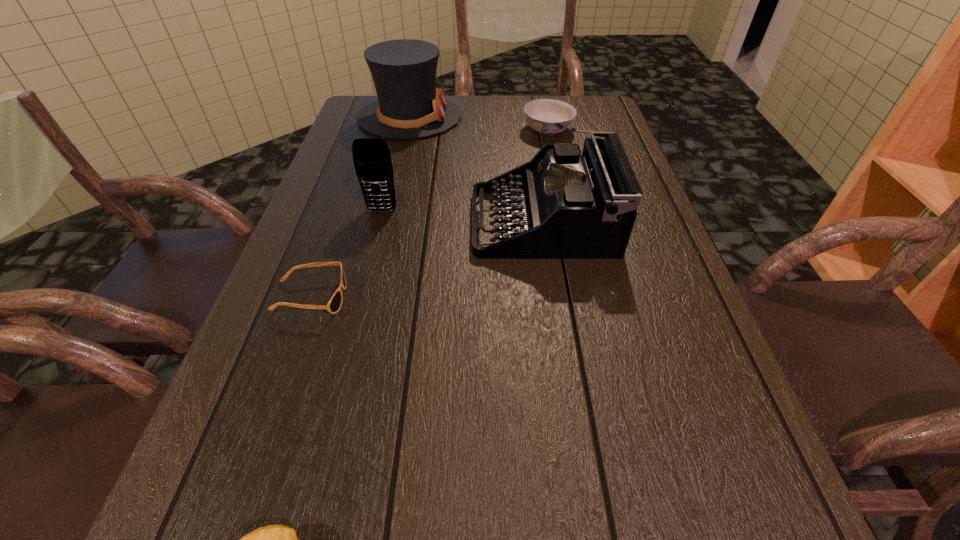
You are a GUI agent. You are given a task and a screenshot of the screen. Output one action in this format:
    pyautogui.click(x=<x>, y=<y>)
    Task: Click on the free point between the dress hat and the bowl
    This screenshot has width=960, height=540.
    Given the screenshot: What is the action you would take?
    pyautogui.click(x=479, y=123)

Where is `vacant space that is in between the bowl and the cellular telephone`? The width and height of the screenshot is (960, 540). vacant space that is in between the bowl and the cellular telephone is located at coordinates (465, 170).

The height and width of the screenshot is (540, 960). I want to click on unoccupied area between the cellular telephone and the bowl, so coord(465,170).

Locate which object ranks third in proximity to the typewriter. Please provide its 2D coordinates. Your answer should be formatted as a tuple, i.e. [(x, y)], where the tuple contains the x and y coordinates of a point satisfying the conditions above.

[(409, 106)]

Locate an element on the screen. object that ranks as the closest to the fifth farthest object is located at coordinates (371, 156).

I want to click on free point that satisfies the following two spatial constraints: 1. with goggles on the front of the dress hat; 2. on the right side of the bowl, so click(x=407, y=130).

You are a GUI agent. You are given a task and a screenshot of the screen. Output one action in this format:
    pyautogui.click(x=<x>, y=<y>)
    Task: Click on the vacant area that satisfies the following two spatial constraints: 1. with goggles on the front of the dress hat; 2. on the screen of the cellular telephone
    The height and width of the screenshot is (540, 960).
    Given the screenshot: What is the action you would take?
    pyautogui.click(x=388, y=210)